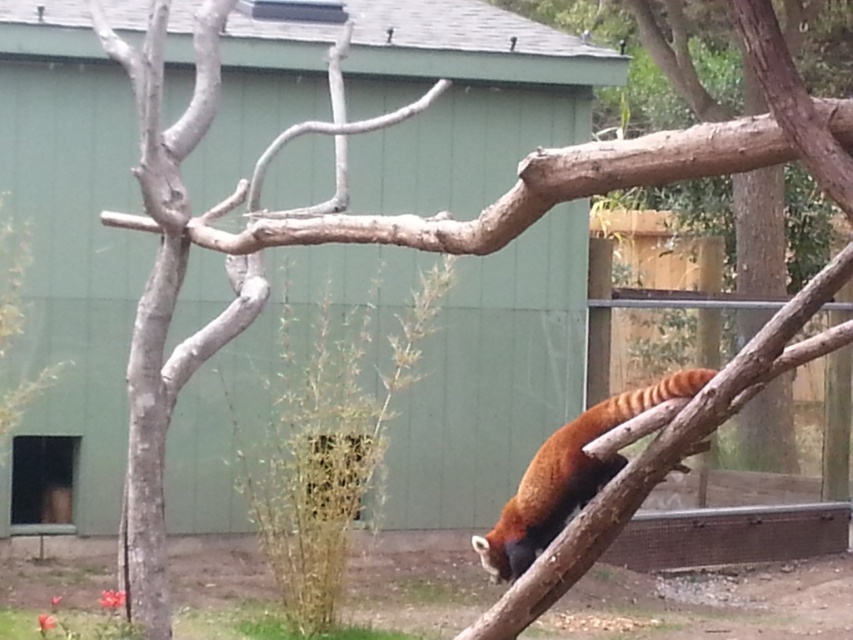
Between point (163, 573) and point (581, 420), which one is positioned behind?

The point (163, 573) is behind.

Identify the location of smooth gray tree trunk at left. This screenshot has height=640, width=853. (148, 445).